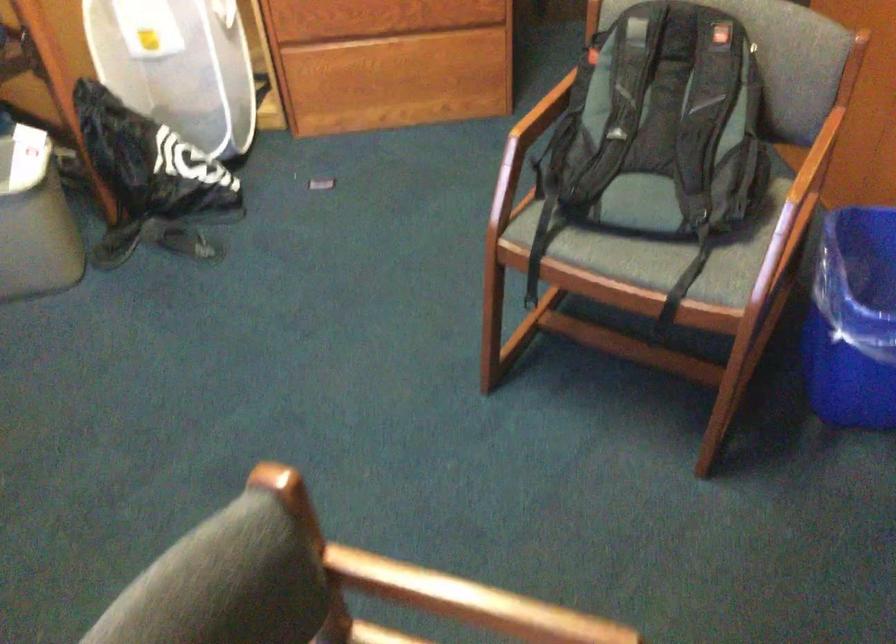
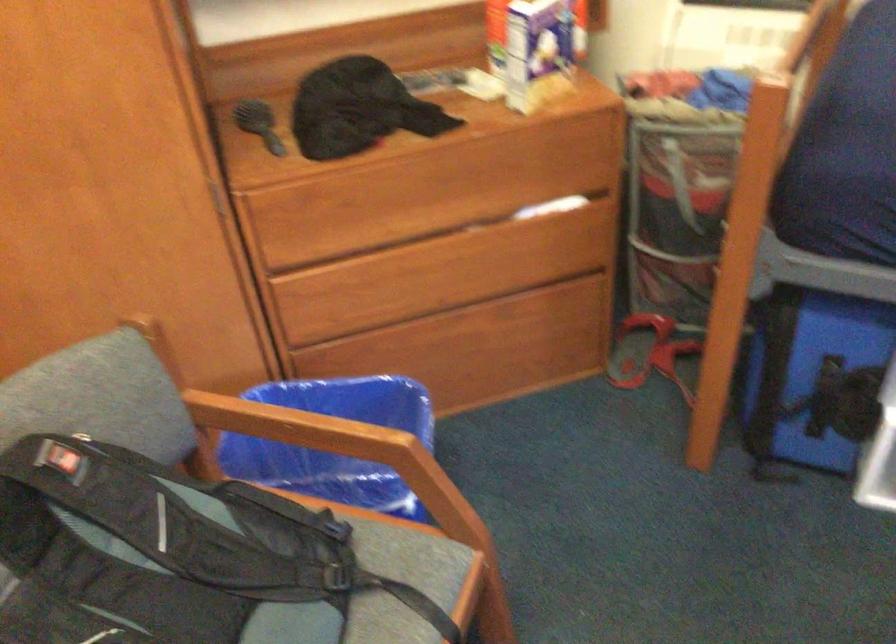
In the second image, find the point that corresponds to point (819, 167) in the first image.

(290, 424)